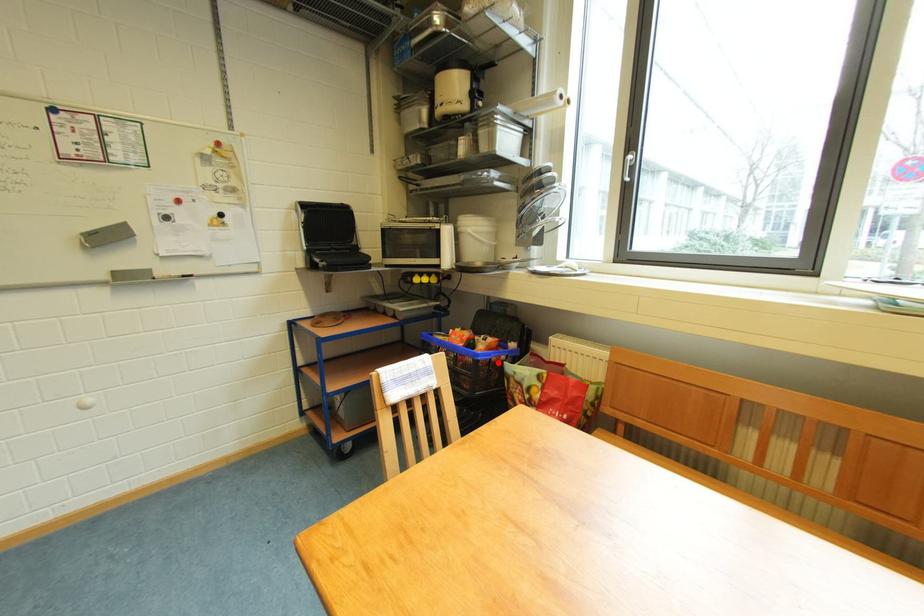
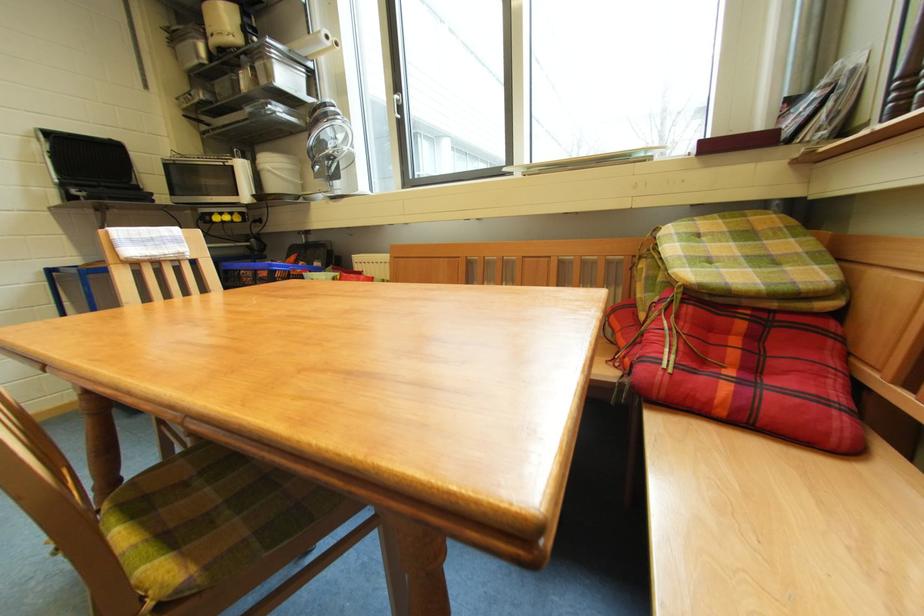
Question: I am providing you with two images of the same scene from different viewpoints. In image1, a red point is highlighted. Considering the same 3D point in image2, which of the following is correct?

Choices:
 (A) It is closer
 (B) It is farther

Answer: (A)